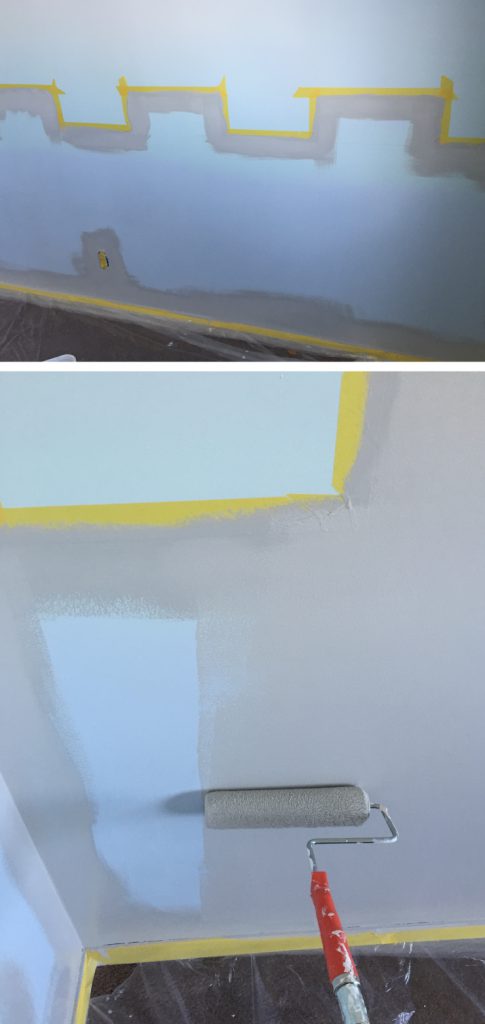
Where is `blue unpainted section of wall`? The height and width of the screenshot is (1024, 485). blue unpainted section of wall is located at coordinates (28, 948), (150, 770), (270, 227), (193, 442).